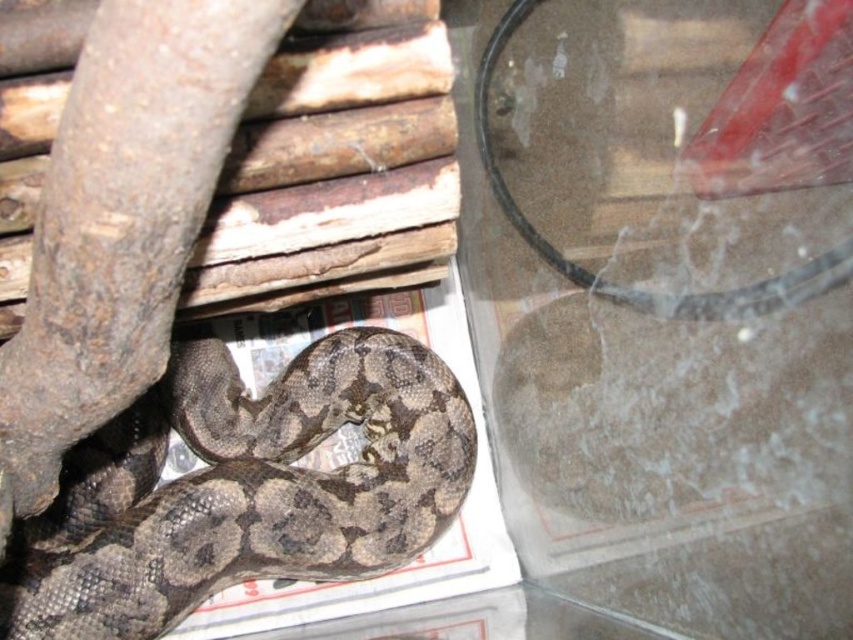
Which of these two, transparent plastic glass at center or brown textured snake at lower left, stands shorter?

With less height is brown textured snake at lower left.

Locate an element on the screen. The height and width of the screenshot is (640, 853). transparent plastic glass at center is located at coordinates (x=659, y=433).

What do you see at coordinates (659, 433) in the screenshot?
I see `transparent plastic glass at center` at bounding box center [659, 433].

Identify the location of transparent plastic glass at center. (659, 433).